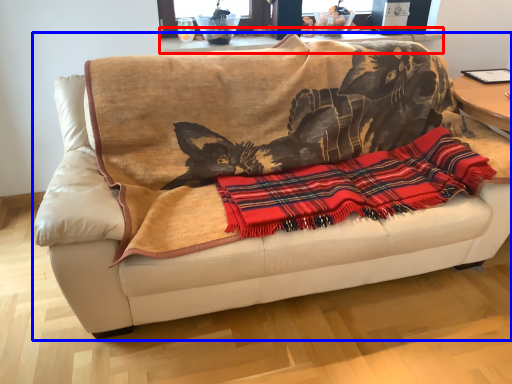
Question: Among these objects, which one is farthest to the camera, table (highlighted by a red box) or studio couch (highlighted by a blue box)?

Choices:
 (A) table
 (B) studio couch

Answer: (A)